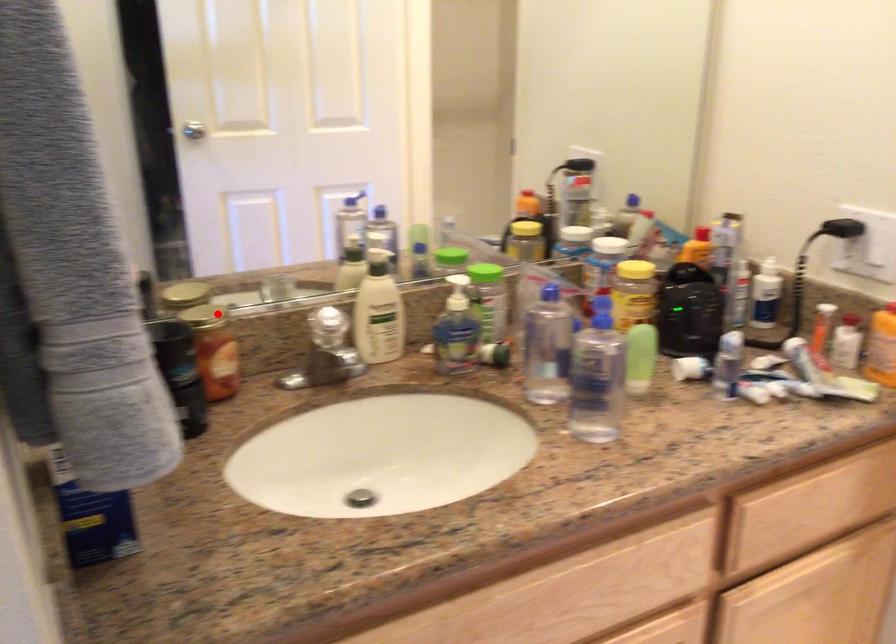
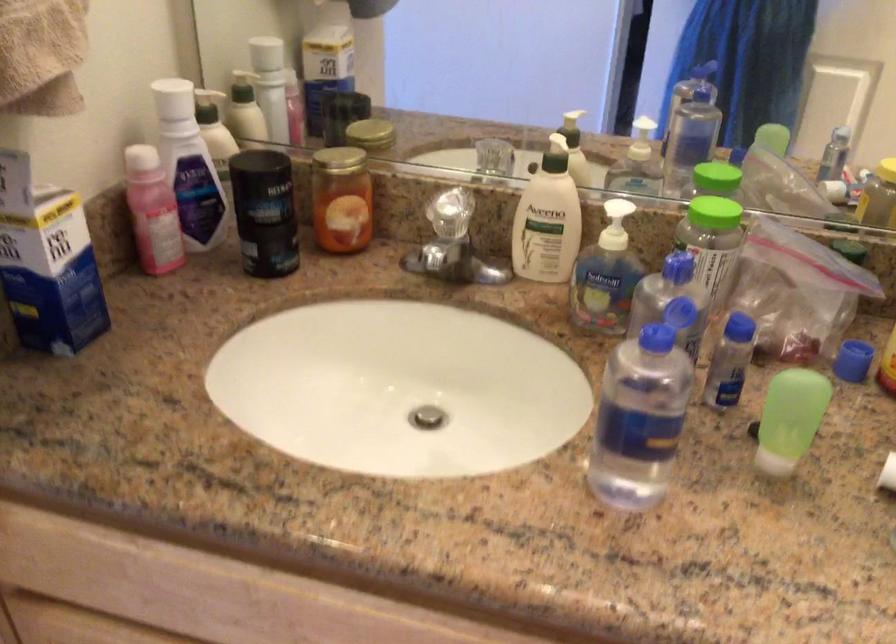
In the second image, find the point that corresponds to the highlighted location in the first image.

(336, 160)